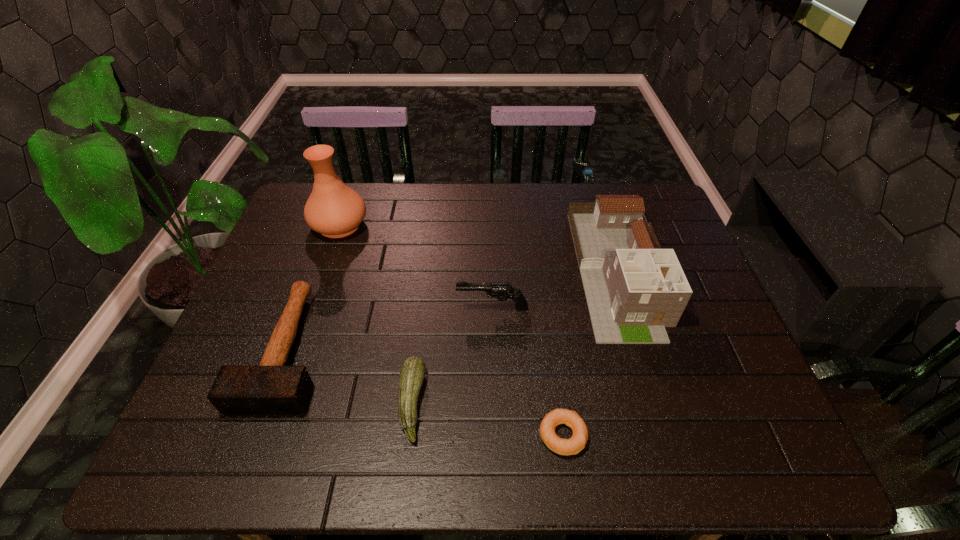
Identify the location of vase. This screenshot has height=540, width=960. (333, 209).

Where is `the second tallest object`? Image resolution: width=960 pixels, height=540 pixels. the second tallest object is located at coordinates (634, 289).

Where is `the rightmost object`? The width and height of the screenshot is (960, 540). the rightmost object is located at coordinates (634, 289).

You are a GUI agent. You are given a task and a screenshot of the screen. Output one action in this format:
    pyautogui.click(x=<x>, y=<y>)
    Task: Click on the gun
    The height and width of the screenshot is (540, 960).
    Given the screenshot: What is the action you would take?
    pyautogui.click(x=502, y=291)

Locate an element on the screen. The image size is (960, 540). mallet is located at coordinates (271, 388).

This screenshot has height=540, width=960. I want to click on zucchini, so click(x=412, y=373).

Locate an element on the screen. the third object from left to right is located at coordinates (412, 373).

What are the coordinates of `the shortest object` in the screenshot? It's located at (572, 446).

You are a GUI agent. You are given a task and a screenshot of the screen. Output one action in this format:
    pyautogui.click(x=<x>, y=<y>)
    Task: Click on the free region located 0.360m on the front of the tallest object
    The image size is (960, 540).
    Given the screenshot: What is the action you would take?
    pyautogui.click(x=299, y=343)

The height and width of the screenshot is (540, 960). I want to click on vacant space located 0.250m at the main entrance of the rightmost object, so click(670, 444).